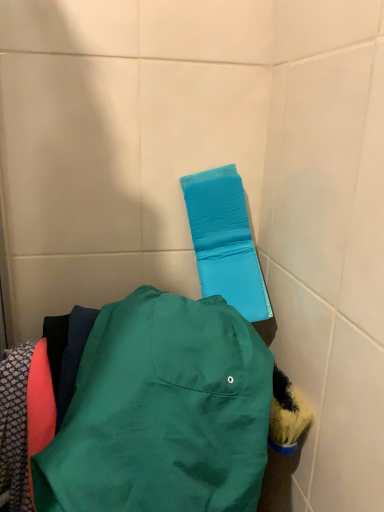
Question: Does blue fabric towel bar at upper center appear on the right side of matte green jacket at center?

Choices:
 (A) no
 (B) yes

Answer: (B)

Question: Is matte green jacket at center inside blue fabric towel bar at upper center?

Choices:
 (A) yes
 (B) no

Answer: (B)

Question: Considering the relative positions of blue fabric towel bar at upper center and matte green jacket at center in the image provided, is blue fabric towel bar at upper center behind matte green jacket at center?

Choices:
 (A) yes
 (B) no

Answer: (A)

Question: Is blue fabric towel bar at upper center positioned with its back to matte green jacket at center?

Choices:
 (A) yes
 (B) no

Answer: (B)

Question: From a real-world perspective, is blue fabric towel bar at upper center on top of matte green jacket at center?

Choices:
 (A) no
 (B) yes

Answer: (B)

Question: Is blue fabric towel bar at upper center shorter than matte green jacket at center?

Choices:
 (A) yes
 (B) no

Answer: (B)

Question: From the image's perspective, would you say matte green jacket at center is shown under blue fabric towel bar at upper center?

Choices:
 (A) no
 (B) yes

Answer: (B)

Question: From a real-world perspective, is matte green jacket at center located beneath blue fabric towel bar at upper center?

Choices:
 (A) yes
 (B) no

Answer: (A)

Question: Is matte green jacket at center bigger than blue fabric towel bar at upper center?

Choices:
 (A) yes
 (B) no

Answer: (A)

Question: Is matte green jacket at center at the left side of blue fabric towel bar at upper center?

Choices:
 (A) yes
 (B) no

Answer: (A)

Question: Is matte green jacket at center next to blue fabric towel bar at upper center?

Choices:
 (A) no
 (B) yes

Answer: (A)

Question: Is matte green jacket at center completely or partially outside of blue fabric towel bar at upper center?

Choices:
 (A) yes
 (B) no

Answer: (A)

Question: From a real-world perspective, is blue fabric towel bar at upper center positioned above or below matte green jacket at center?

Choices:
 (A) above
 (B) below

Answer: (A)